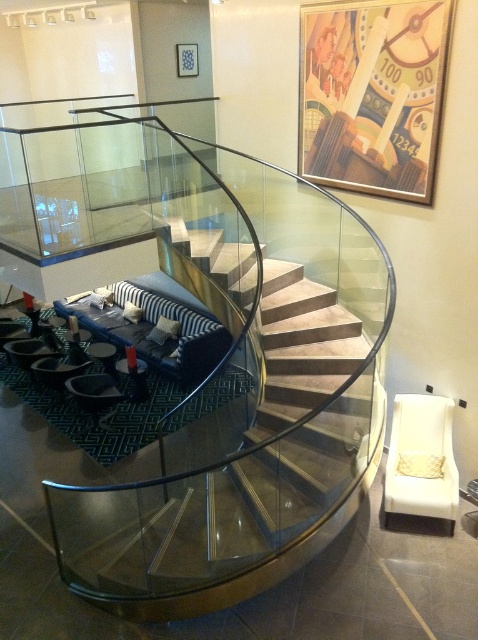
Question: In this image, where is clear glass staircase at center located relative to transparent glass table at lower left?

Choices:
 (A) above
 (B) below

Answer: (B)

Question: Which of the following is the closest to the observer?

Choices:
 (A) (173, 433)
 (B) (134, 378)

Answer: (A)

Question: Does clear glass staircase at center appear on the right side of transparent glass table at lower left?

Choices:
 (A) no
 (B) yes

Answer: (B)

Question: Can you confirm if clear glass staircase at center is bigger than transparent glass table at lower left?

Choices:
 (A) no
 (B) yes

Answer: (A)